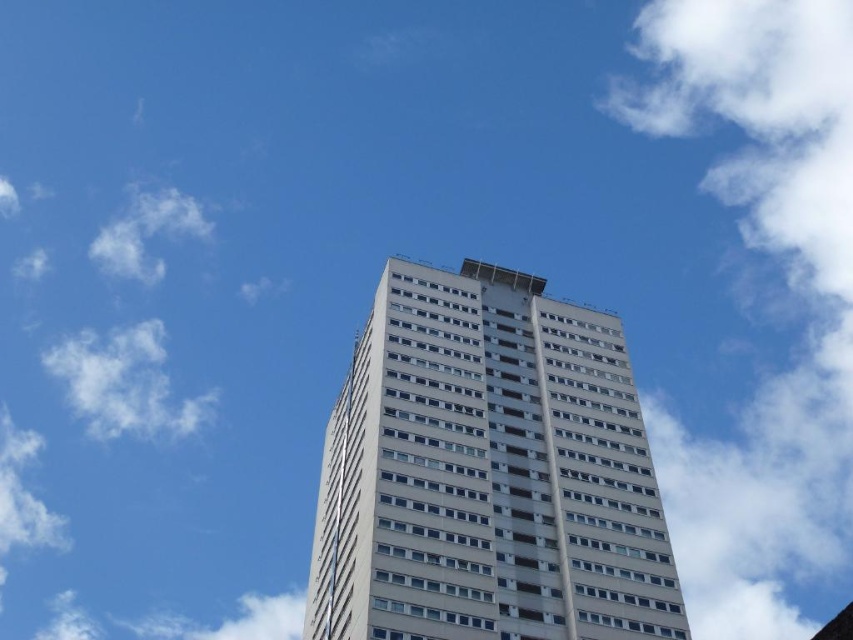
In the scene shown: Can you confirm if white smooth building at center is shorter than white fluffy cloud at upper left?

Indeed, white smooth building at center has a lesser height compared to white fluffy cloud at upper left.

Can you confirm if white smooth building at center is positioned above white fluffy cloud at upper left?

Yes.

Image resolution: width=853 pixels, height=640 pixels. What do you see at coordinates (486, 472) in the screenshot? I see `white smooth building at center` at bounding box center [486, 472].

Identify the location of white smooth building at center. (486, 472).